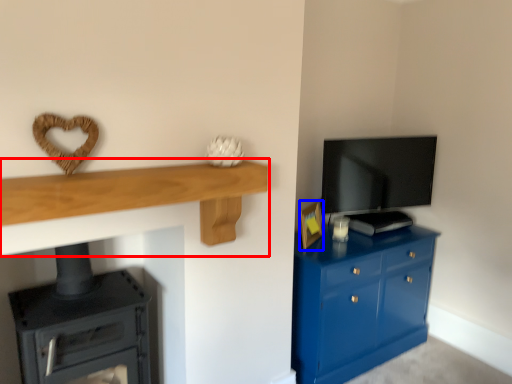
Question: Which of the following is the farthest to the observer, shelf (highlighted by a red box) or picture frame (highlighted by a blue box)?

Choices:
 (A) shelf
 (B) picture frame

Answer: (B)